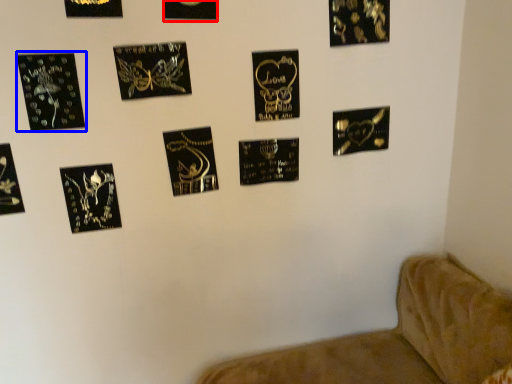
Question: Which object is further to the camera taking this photo, picture frame (highlighted by a red box) or picture frame (highlighted by a blue box)?

Choices:
 (A) picture frame
 (B) picture frame

Answer: (A)